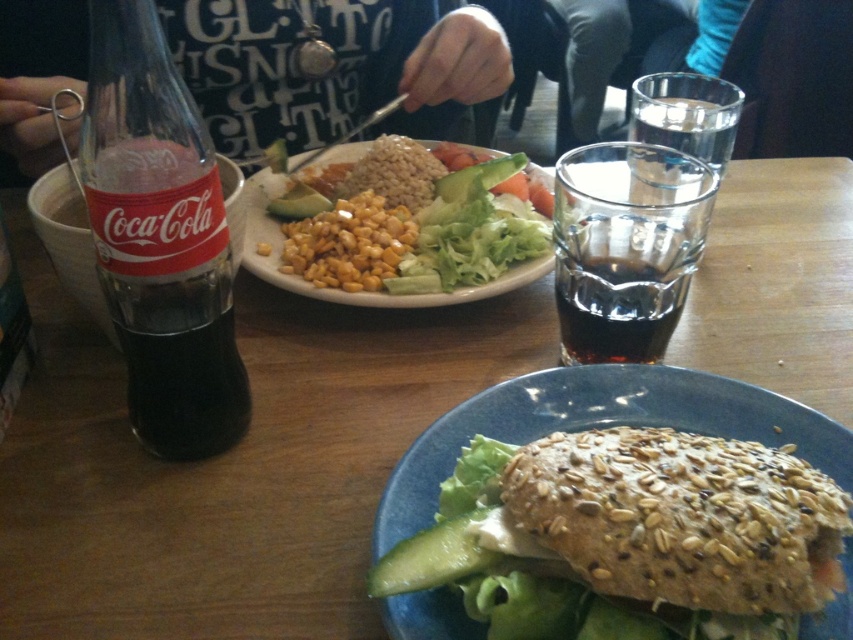
Does black glass coca-cola bottle at left come behind green smooth pickle at lower center?

Yes, black glass coca-cola bottle at left is further from the viewer.

Looking at this image, can you confirm if black glass coca-cola bottle at left is taller than green smooth pickle at lower center?

Yes.

I want to click on black glass coca-cola bottle at left, so click(x=160, y=237).

Where is `black glass coca-cola bottle at left`? This screenshot has height=640, width=853. black glass coca-cola bottle at left is located at coordinates (x=160, y=237).

Does black glass coca-cola bottle at left have a larger size compared to yellow corn at center?

Incorrect, black glass coca-cola bottle at left is not larger than yellow corn at center.

Does black glass coca-cola bottle at left appear on the left side of yellow corn at center?

Correct, you'll find black glass coca-cola bottle at left to the left of yellow corn at center.

Who is more forward, (219, 348) or (506, 214)?

Point (219, 348) is more forward.

You are a GUI agent. You are given a task and a screenshot of the screen. Output one action in this format:
    pyautogui.click(x=<x>, y=<y>)
    Task: Click on the black glass coca-cola bottle at left
    The width and height of the screenshot is (853, 640).
    Given the screenshot: What is the action you would take?
    pyautogui.click(x=160, y=237)

Can you confirm if black glass coca-cola bottle at left is shorter than dark glass cup at upper center?

In fact, black glass coca-cola bottle at left may be taller than dark glass cup at upper center.

Between point (134, 49) and point (639, 284), which one is positioned behind?

The point (639, 284) is behind.

What do you see at coordinates (160, 237) in the screenshot? I see `black glass coca-cola bottle at left` at bounding box center [160, 237].

In order to click on black glass coca-cola bottle at left in this screenshot , I will do `click(160, 237)`.